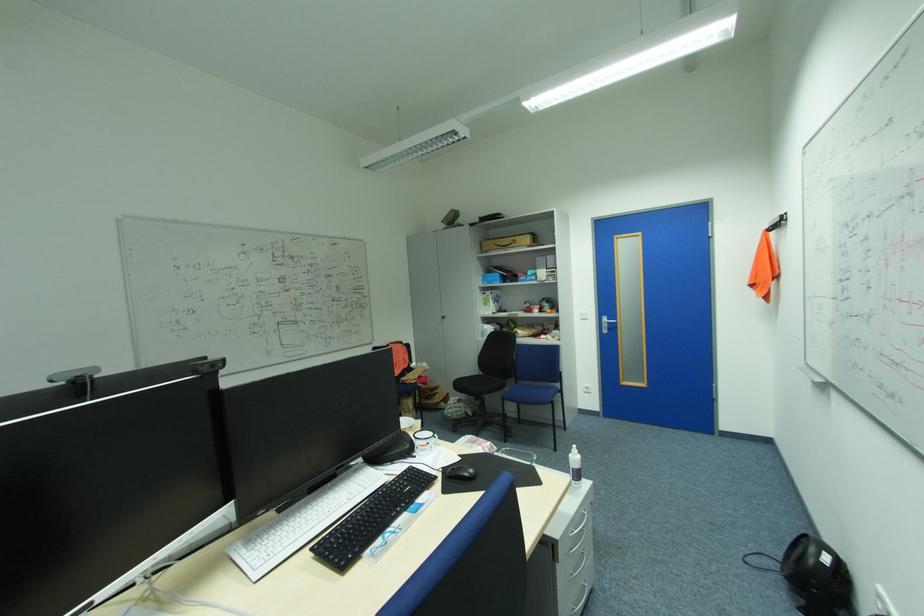
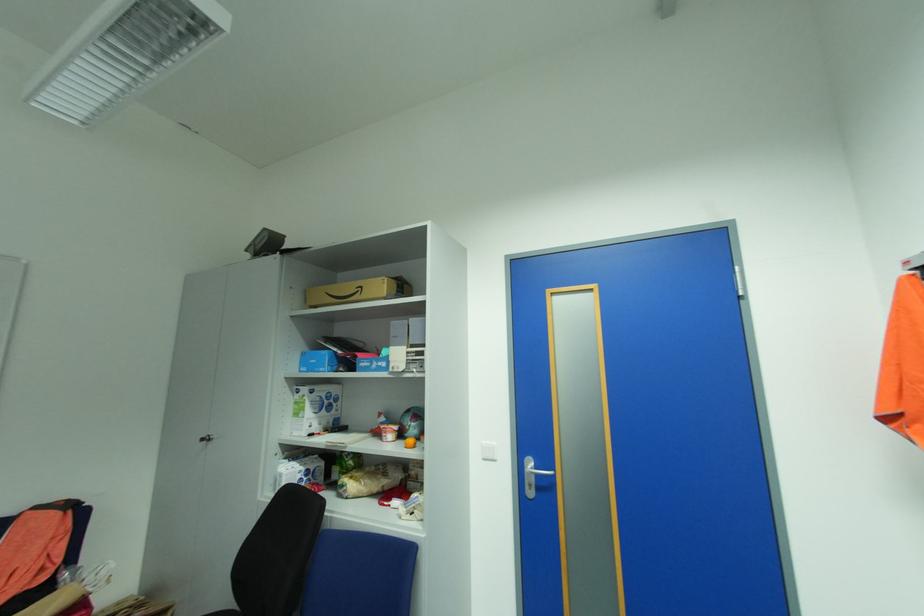
Where in the second image is the point corresponding to (x=521, y=240) from the first image?

(368, 286)